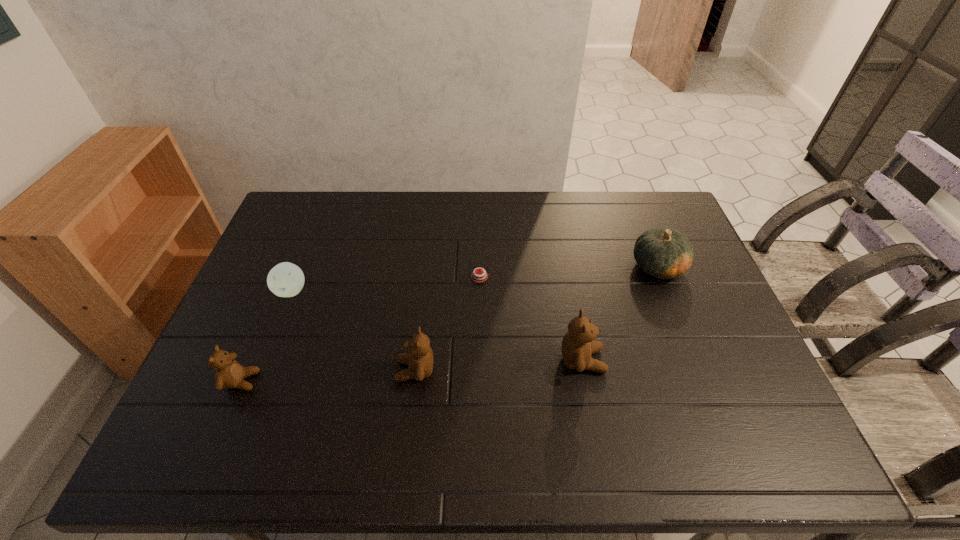
You are a GUI agent. You are given a task and a screenshot of the screen. Output one action in this format:
    pyautogui.click(x=<x>, y=<y>)
    Task: Click on the free location at the far edge of the desktop
    
    Given the screenshot: What is the action you would take?
    pyautogui.click(x=418, y=213)

I want to click on free spot at the near edge of the desktop, so (x=484, y=386).

In the image, there is a desktop. At what (x,y) coordinates should I click in order to perform the action: click on vacant space at the right edge. Please return your answer as a coordinate pair (x, y). Looking at the image, I should click on (682, 278).

Image resolution: width=960 pixels, height=540 pixels. In the image, there is a desktop. What are the coordinates of `free space at the far left corner` in the screenshot? It's located at (301, 204).

Identify the location of free space at the far right corner of the desktop. (632, 216).

Locate an element on the screen. vacant space in between the rightmost teddy bear and the fourth object from right to left is located at coordinates (499, 366).

At what (x,y) coordinates should I click in order to perform the action: click on free space between the gourd and the third object from right to left. Please return your answer as a coordinate pair (x, y). Looking at the image, I should click on (569, 272).

Where is `free space between the second teddy bear from right to left and the shortest object`? This screenshot has height=540, width=960. free space between the second teddy bear from right to left and the shortest object is located at coordinates (447, 323).

Find the location of a particular element. The image size is (960, 540). free space between the chocolate cake and the apple is located at coordinates (386, 284).

You are a GUI agent. You are given a task and a screenshot of the screen. Output one action in this format:
    pyautogui.click(x=<x>, y=<y>)
    Task: Click on the vacant area that lies between the second tallest teddy bear and the second object from right to left
    The height and width of the screenshot is (540, 960).
    Given the screenshot: What is the action you would take?
    pyautogui.click(x=499, y=366)